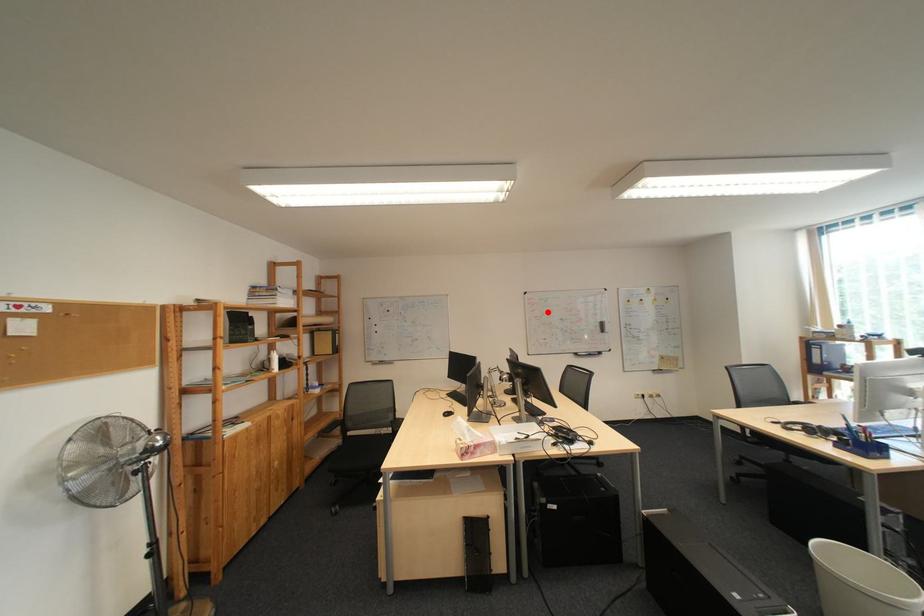
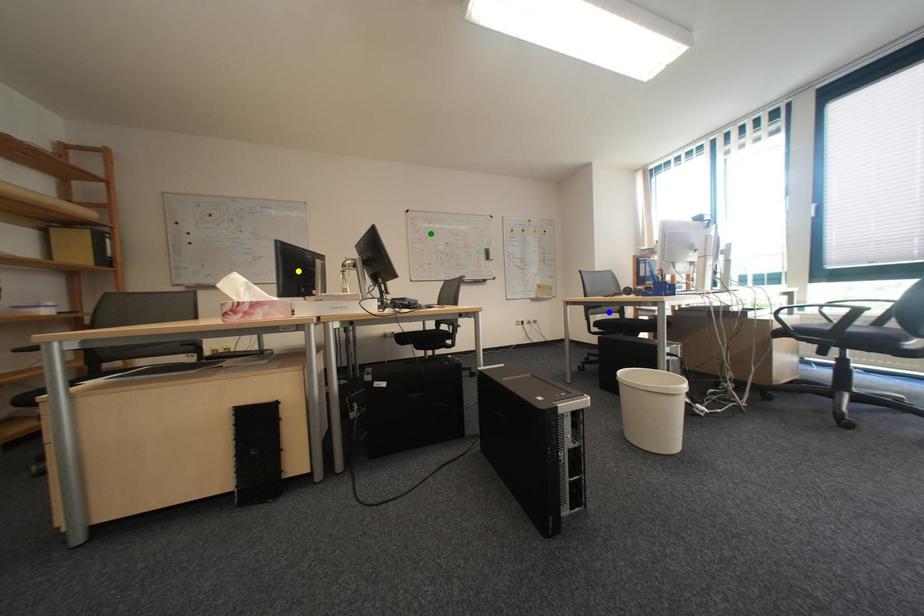
Question: I am providing you with two images of the same scene from different viewpoints. A red point is marked on the first image. You are given multiple points on the second image. In image 2, which mark is for the same physical point as the one in image 1?

Choices:
 (A) blue point
 (B) yellow point
 (C) green point

Answer: (C)